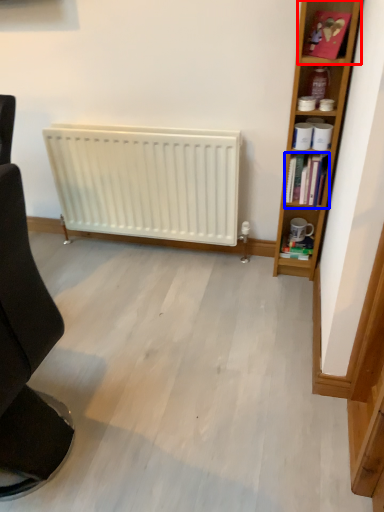
Question: Which point is further to the camera, cabinet (highlighted by a red box) or book (highlighted by a blue box)?

Choices:
 (A) cabinet
 (B) book

Answer: (B)